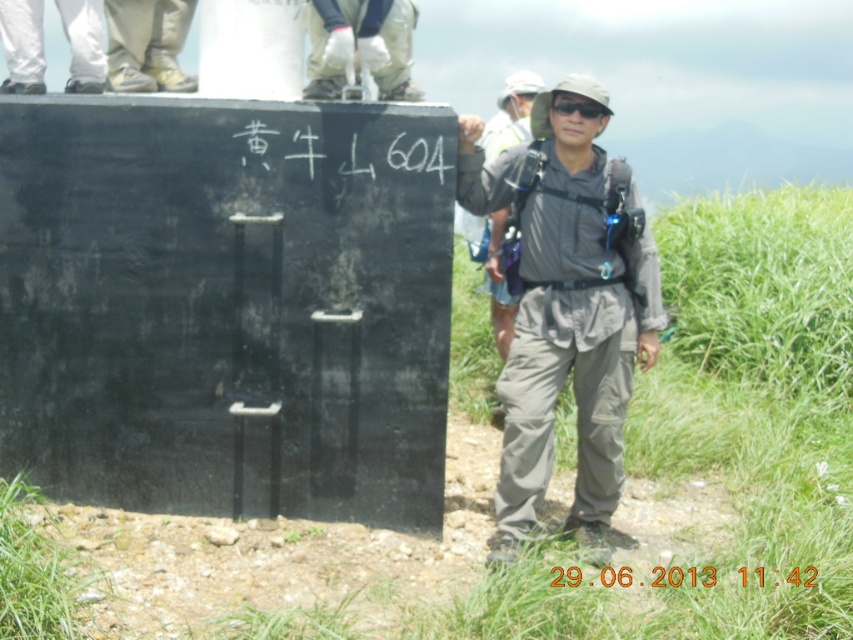
You are a photographer trying to capture the gray fabric jacket at center and the light beige canvas shoes at upper left in the same frame. Based on their positions, which object should you focus on first to ensure both are in the frame?

The gray fabric jacket at center is wider than the light beige canvas shoes at upper left, so you should focus on the gray fabric jacket at center first to ensure both fit in the frame.

You are a hiker who wants to take a photo of the black matte text at center. Where should you position yourself relative to the man in the image to ensure the text is in the center of your camera view?

The black matte text at center is located at point (683, 577), so you should position yourself directly in front of the man to ensure the text is centered in your camera view.

You are a photographer trying to capture the light beige canvas shoes at upper left and the black matte goggles at center in the same frame. Since you want to ensure both are clearly visible, which object should you focus on first considering their sizes?

The light beige canvas shoes at upper left has a greater height compared to the black matte goggles at center, so you should focus on the light beige canvas shoes at upper left first to ensure clarity.